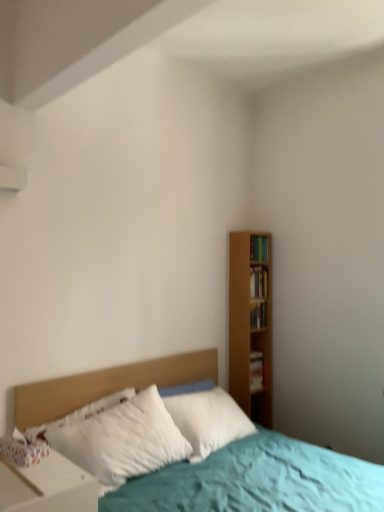
Question: Looking at the image, does wooden bookshelf at right, arranged as the 3th book when viewed from the top, seem bigger or smaller compared to white soft pillow at center?

Choices:
 (A) big
 (B) small

Answer: (B)

Question: In the image, is wooden bookshelf at right, arranged as the 3th book when viewed from the top, on the left side or the right side of white soft pillow at center?

Choices:
 (A) left
 (B) right

Answer: (B)

Question: Which of these objects is positioned closest to the wooden bookshelf at right, the 2th book viewed from the top?

Choices:
 (A) white glossy nightstand at lower left
 (B) white soft pillow at center
 (C) hardcover book at right, the fourth book when ordered from top to bottom
 (D) wooden bookshelf at right, which is the second book from bottom to top
 (E) wooden bookshelf at right, which is the fourth book from bottom to top

Answer: (D)

Question: Estimate the real-world distances between objects in this image. Which object is farther from the wooden bookshelf at right, which is the second book from bottom to top?

Choices:
 (A) white soft pillow at center
 (B) hardcover book at right, the fourth book when ordered from top to bottom
 (C) white glossy nightstand at lower left
 (D) wooden bookshelf at right, the 1th book in the top-to-bottom sequence
 (E) wooden bookshelf at right, the 2th book viewed from the top

Answer: (C)